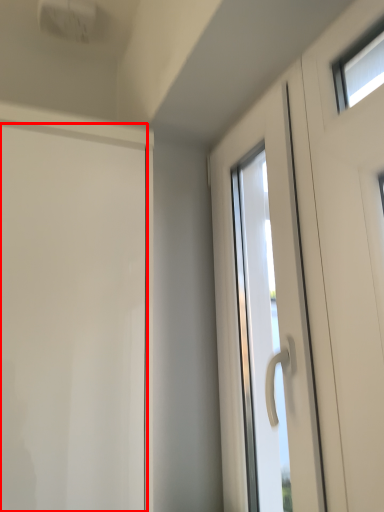
Question: In this image, where is door (annotated by the red box) located relative to door?

Choices:
 (A) left
 (B) right

Answer: (A)